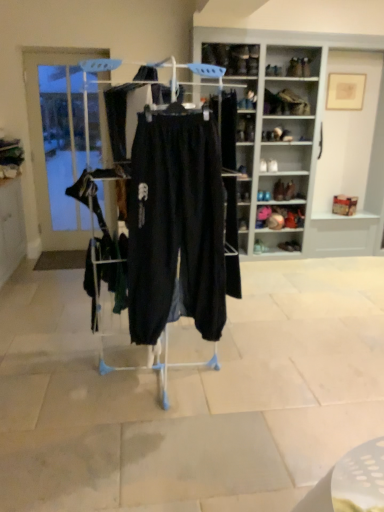
Identify the location of matte black shoe at center, which is the 1th footwear from right to left. (289, 246).

What do you see at coordinates (289, 246) in the screenshot? I see `matte black shoe at center, which is the 1th footwear from right to left` at bounding box center [289, 246].

Image resolution: width=384 pixels, height=512 pixels. I want to click on clear glass door at left, so click(57, 141).

Where is `matte black shoe at center, which appears as the 2th shelf when viewed from the right`? Image resolution: width=384 pixels, height=512 pixels. matte black shoe at center, which appears as the 2th shelf when viewed from the right is located at coordinates (243, 218).

The width and height of the screenshot is (384, 512). I want to click on black cotton pants at center, so click(x=175, y=227).

From the image's perspective, which one is positioned higher, matte black shoe at center, the 4th footwear viewed from the left, or matte black shoe at center, positioned as the first footwear in left-to-right order?

matte black shoe at center, the 4th footwear viewed from the left, appears higher in the image.

From the matte black shoe at center, the second footwear in the bottom-to-top sequence, count the 3rd footwear to the left and point to it. Please provide its 2D coordinates.

[(259, 247)]

Is point (299, 250) closer or farther from the camera than point (259, 239)?

Point (299, 250) appears to be farther away from the viewer than point (259, 239).

Which object is wider, matte black shoe at center, which is the 1th footwear from right to left, or matte black shoe at center, arranged as the 1th footwear when ordered from the bottom?

matte black shoe at center, arranged as the 1th footwear when ordered from the bottom.

Which object is further away from the camera, white glossy tile at lower right or matte black shoe at center, the 3th footwear from the left?

matte black shoe at center, the 3th footwear from the left, is further away from the camera.

From a real-world perspective, which is physically below, white glossy tile at lower right or matte black shoe at center, the first footwear from the top?

In real-world perspective, white glossy tile at lower right is lower.

How many degrees apart are the facing directions of white glossy tile at lower right and matte black shoe at center, the first footwear from the top?

They differ by 133 degrees in their facing directions.

Identify the location of the 1st footwear behind the white glossy tile at lower right, counting from the anchor's position. click(x=289, y=191).

From a real-world perspective, is matte black shoe at center, the 2th footwear when ordered from top to bottom, below matte black shoe at center, arranged as the 1th footwear when ordered from the bottom?

No, from a real-world perspective, matte black shoe at center, the 2th footwear when ordered from top to bottom, is not below matte black shoe at center, arranged as the 1th footwear when ordered from the bottom.

From the image's perspective, is matte black shoe at center, the second footwear when ordered from left to right, on matte black shoe at center, positioned as the first footwear in left-to-right order?

Yes, from the image's perspective, matte black shoe at center, the second footwear when ordered from left to right, is on top of matte black shoe at center, positioned as the first footwear in left-to-right order.

Is matte black shoe at center, which ranks as the 3th footwear in right-to-left order, thinner than matte black shoe at center, arranged as the 1th footwear when ordered from the bottom?

In fact, matte black shoe at center, which ranks as the 3th footwear in right-to-left order, might be wider than matte black shoe at center, arranged as the 1th footwear when ordered from the bottom.

Would you say matte black shoe at center, the 4th footwear viewed from the top, contains clear glass door at left?

Definitely not — clear glass door at left is not inside matte black shoe at center, the 4th footwear viewed from the top.

From the image's perspective, is matte black shoe at center, the 4th footwear viewed from the top, positioned above or below clear glass door at left?

matte black shoe at center, the 4th footwear viewed from the top, is below clear glass door at left.

Does matte black shoe at center, arranged as the 1th footwear when ordered from the bottom, have a greater height compared to clear glass door at left?

No, matte black shoe at center, arranged as the 1th footwear when ordered from the bottom, is not taller than clear glass door at left.

In the image, is matte black shoe at center, positioned as the first footwear in left-to-right order, on the left side or the right side of clear glass door at left?

matte black shoe at center, positioned as the first footwear in left-to-right order, is to the right of clear glass door at left.

Is matte black shoe at center, the second footwear in the bottom-to-top sequence, surrounded by matte black shoe at center, marked as the 4th footwear in a bottom-to-top arrangement?

No, matte black shoe at center, the second footwear in the bottom-to-top sequence, is not a part of matte black shoe at center, marked as the 4th footwear in a bottom-to-top arrangement.

From the image's perspective, is matte black shoe at center, the second footwear viewed from the right, positioned above or below matte black shoe at center, the 4th footwear viewed from the left?

matte black shoe at center, the second footwear viewed from the right, is situated higher than matte black shoe at center, the 4th footwear viewed from the left, in the image.

Is matte black shoe at center, the second footwear viewed from the right, not close to matte black shoe at center, the second footwear in the bottom-to-top sequence?

matte black shoe at center, the second footwear viewed from the right, is actually quite close to matte black shoe at center, the second footwear in the bottom-to-top sequence.

The height and width of the screenshot is (512, 384). Identify the location of footwear on the right of the matte black shoe at center, marked as the 4th footwear in a bottom-to-top arrangement. (289, 246).

Does matte black shoe at center, which is counted as the 4th footwear, starting from the right, touch white wood shelves at upper right, the 1th shelf from the right?

matte black shoe at center, which is counted as the 4th footwear, starting from the right, is not next to white wood shelves at upper right, the 1th shelf from the right, and they're not touching.

From a real-world perspective, is matte black shoe at center, positioned as the first footwear in left-to-right order, under white wood shelves at upper right, positioned as the first shelf in top-to-bottom order?

Yes, from a real-world perspective, matte black shoe at center, positioned as the first footwear in left-to-right order, is below white wood shelves at upper right, positioned as the first shelf in top-to-bottom order.

Which is behind, point (256, 250) or point (260, 189)?

The point (256, 250) is farther.

Does matte black shoe at center, which is counted as the 4th footwear, starting from the right, have a greater height compared to white wood shelves at upper right, the 1th shelf from the right?

No.

Is white wood shelves at upper right, the 2th shelf positioned from the bottom, positioned beyond the bounds of matte black shoe at center, the second footwear viewed from the right?

white wood shelves at upper right, the 2th shelf positioned from the bottom, lies outside matte black shoe at center, the second footwear viewed from the right,'s area.

From the white wood shelves at upper right, the 1th shelf from the right, count 1st footwears backward and point to it. Please provide its 2D coordinates.

[(289, 191)]

Between point (317, 191) and point (285, 197), which one is positioned in front?

The point (285, 197) is closer to the camera.

Identify the location of the 3rd footwear counting from the right side of the matte black shoe at center, arranged as the 1th footwear when ordered from the bottom. The height and width of the screenshot is (512, 384). pyautogui.click(x=289, y=246).

Where is `the 1st footwear behind the white glossy tile at lower right`? The image size is (384, 512). the 1st footwear behind the white glossy tile at lower right is located at coordinates (289, 191).

Which object lies further to the anchor point matte black shoe at center, which ranks as the 3th footwear in bottom-to-top order, matte black shoe at center, arranged as the 1th footwear when ordered from the bottom, or matte black shoe at center, the second footwear in the bottom-to-top sequence?

The object further to matte black shoe at center, which ranks as the 3th footwear in bottom-to-top order, is matte black shoe at center, arranged as the 1th footwear when ordered from the bottom.

From the picture: When comparing their distances from matte black shoe at center, marked as the 4th footwear in a bottom-to-top arrangement, does black cotton pants at center or matte black shoe at center, which is the 1th footwear from right to left, seem further?

Among the two, black cotton pants at center is located further to matte black shoe at center, marked as the 4th footwear in a bottom-to-top arrangement.

From the image, which object appears to be nearer to matte black shoe at center, the third footwear positioned from the top, white glossy tile at lower right or white wood shelves at upper right, positioned as the first shelf in top-to-bottom order?

white wood shelves at upper right, positioned as the first shelf in top-to-bottom order, is closer to matte black shoe at center, the third footwear positioned from the top.

Considering their positions, is matte black shoe at center, positioned as the first footwear in left-to-right order, positioned further to white wood shelves at upper right, which is the second shelf from left to right, than matte black shoe at center, the 2th footwear when ordered from top to bottom?

matte black shoe at center, positioned as the first footwear in left-to-right order, is positioned further to the anchor white wood shelves at upper right, which is the second shelf from left to right.

Which object lies further to the anchor point white wood shelves at upper right, which is the second shelf from left to right, clear glass door at left or white glossy tile at lower right?

white glossy tile at lower right is positioned further to the anchor white wood shelves at upper right, which is the second shelf from left to right.

Looking at the image, which one is located further to clear glass door at left, white wood shelves at upper right, the 2th shelf positioned from the bottom, or matte black shoe at center, arranged as the 1th footwear when ordered from the bottom?

Based on the image, matte black shoe at center, arranged as the 1th footwear when ordered from the bottom, appears to be further to clear glass door at left.

Which object lies nearer to the anchor point matte black shoe at center, which appears as the first shelf when ordered from the bottom, matte black shoe at center, the second footwear viewed from the right, or white wood shelves at upper right, the 2th shelf positioned from the bottom?

matte black shoe at center, the second footwear viewed from the right, lies closer to matte black shoe at center, which appears as the first shelf when ordered from the bottom, than the other object.

Which object lies nearer to the anchor point white wood shelves at upper right, which is the second shelf from left to right, matte black shoe at center, the third footwear positioned from the top, or matte black shoe at center, arranged as the 1th footwear when ordered from the bottom?

matte black shoe at center, the third footwear positioned from the top, is closer to white wood shelves at upper right, which is the second shelf from left to right.

This screenshot has width=384, height=512. I want to click on shelf between clear glass door at left and matte black shoe at center, the 4th footwear viewed from the top, in the horizontal direction, so click(243, 218).

Identify the location of shelf between white glossy tile at lower right and matte black shoe at center, which ranks as the 1th shelf in left-to-right order, along the z-axis. (302, 135).

Locate an element on the screen. door positioned between white glossy tile at lower right and matte black shoe at center, which ranks as the 3th footwear in bottom-to-top order, from near to far is located at coordinates (57, 141).

Identify the location of shelf between white glossy tile at lower right and matte black shoe at center, the second footwear when ordered from left to right, along the z-axis. (302, 135).